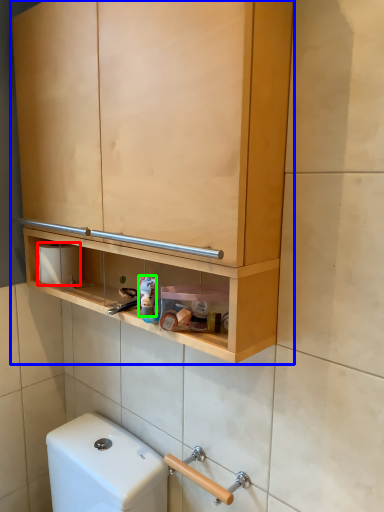
Question: Estimate the real-world distances between objects in this image. Which object is farther from toilet paper (highlighted by a red box), cabinetry (highlighted by a blue box) or toiletry (highlighted by a green box)?

Choices:
 (A) cabinetry
 (B) toiletry

Answer: (A)